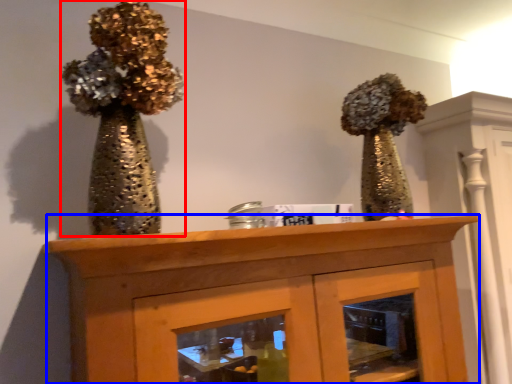
Question: Which object appears closest to the camera in this image, floral arrangement (highlighted by a red box) or furniture (highlighted by a blue box)?

Choices:
 (A) floral arrangement
 (B) furniture

Answer: (B)